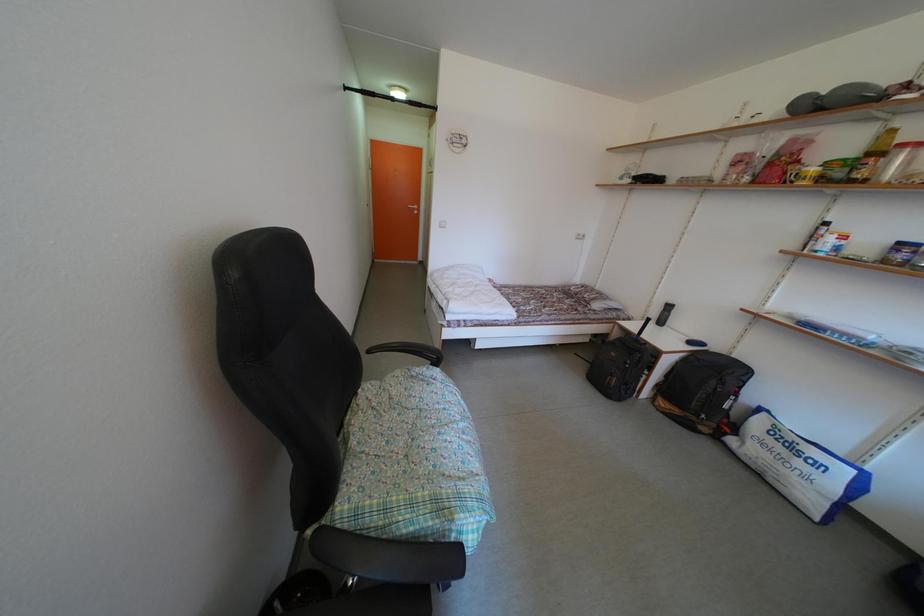
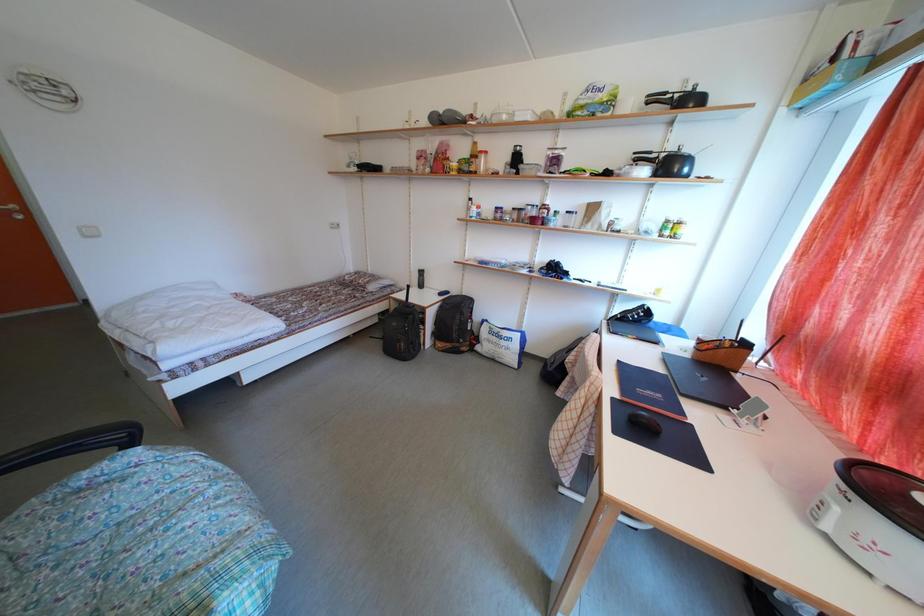
Question: The camera is either moving clockwise (left) or counter-clockwise (right) around the object. The first image is from the beginning of the video and the second image is from the end. Is the camera moving left or right when shooting the video?

Choices:
 (A) Left
 (B) Right

Answer: (A)